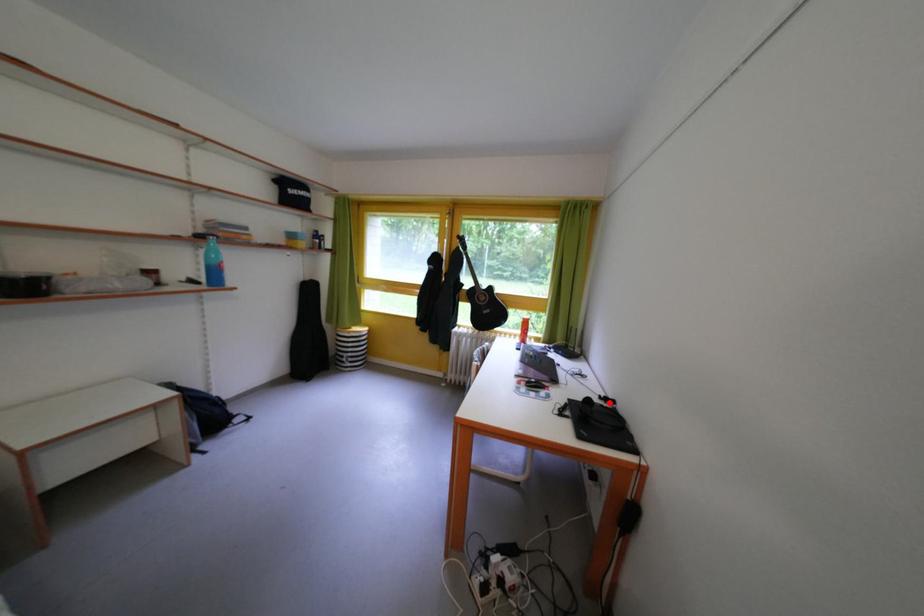
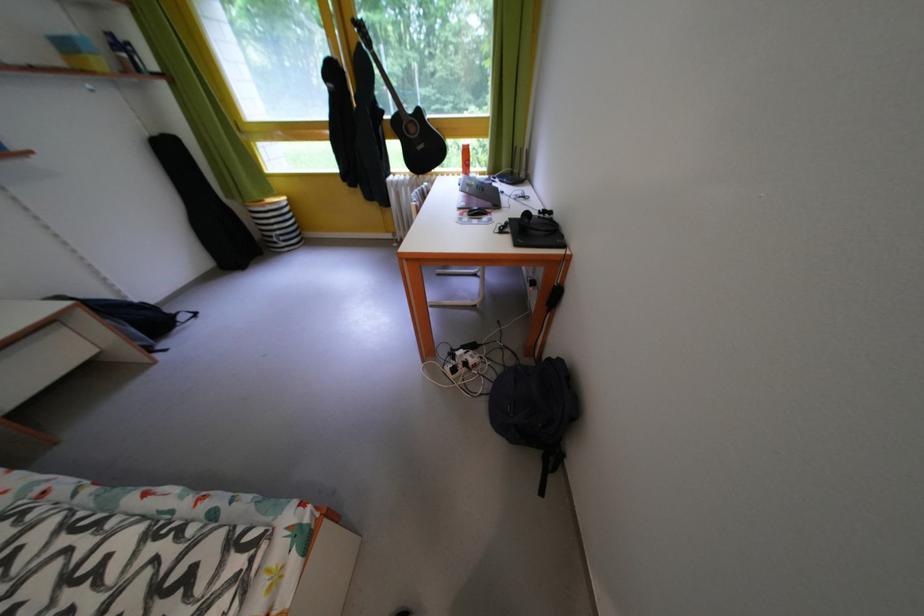
Where in the second image is the point corresponding to the highlighted location from the first image?

(550, 217)